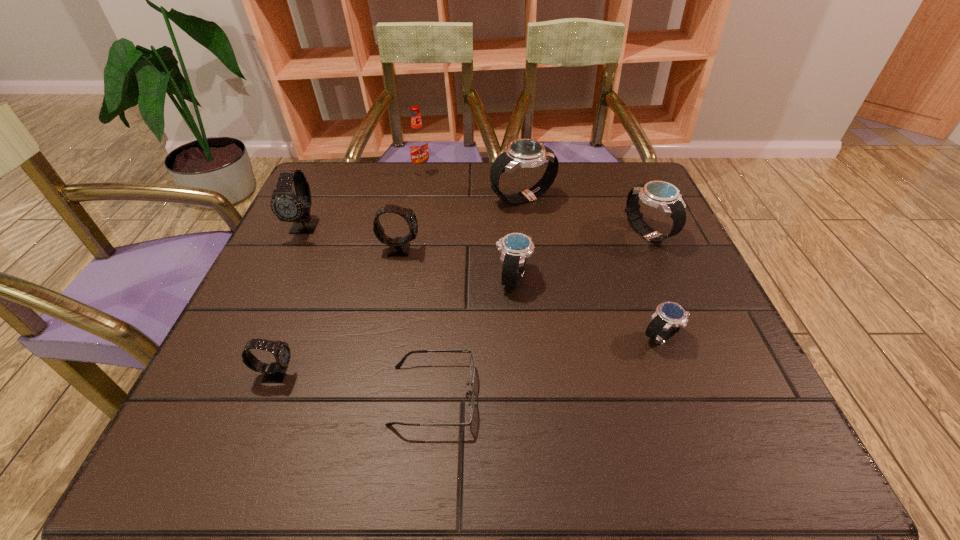
You are a GUI agent. You are given a task and a screenshot of the screen. Output one action in this format:
    pyautogui.click(x=<x>, y=<y>)
    Task: Click on the smallest gray watch
    The image size is (960, 540).
    Given the screenshot: What is the action you would take?
    pyautogui.click(x=273, y=373)

I want to click on the nearest watch, so click(273, 373).

You are a GUI agent. You are given a task and a screenshot of the screen. Output one action in this format:
    pyautogui.click(x=<x>, y=<y>)
    Task: Click on the shortest watch
    
    Given the screenshot: What is the action you would take?
    pyautogui.click(x=669, y=317)

Locate an element on the screen. The height and width of the screenshot is (540, 960). the smallest silver watch is located at coordinates (669, 317).

The image size is (960, 540). I want to click on the shortest object, so click(472, 368).

This screenshot has height=540, width=960. I want to click on vacant space located 0.250m on the right of the tallest object, so click(x=516, y=172).

This screenshot has width=960, height=540. Find the location of `free space located on the back of the second farthest object`. free space located on the back of the second farthest object is located at coordinates (519, 173).

Identify the location of vacant space located on the face of the biggest gray watch. (283, 274).

Locate an element on the screen. vacant area located on the left of the third smallest silver watch is located at coordinates (467, 233).

Identify the location of vacant space located 0.380m on the face of the fifth watch from right to left. (582, 249).